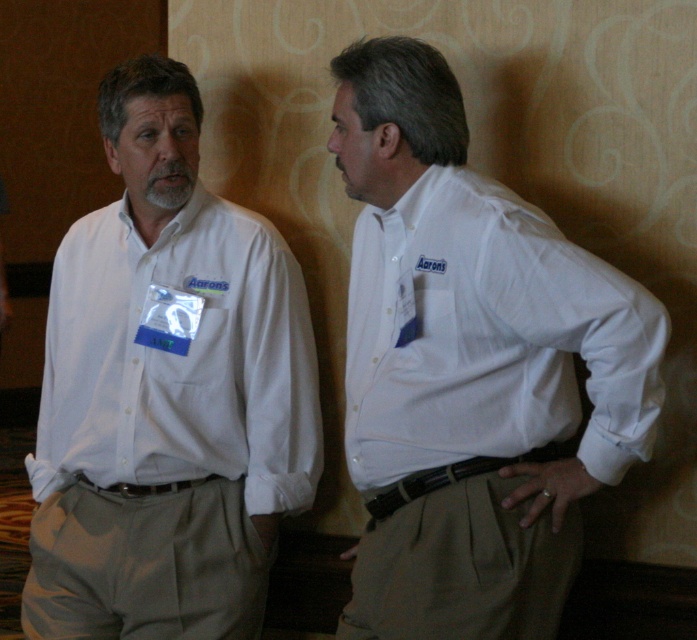
Who is taller, white cotton shirt at right or white cotton shirt at left?

With more height is white cotton shirt at left.

In the scene shown: Between white cotton shirt at right and white cotton shirt at left, which one is positioned lower?

white cotton shirt at left

Between point (454, 259) and point (56, 554), which one is positioned in front?

Positioned in front is point (454, 259).

I want to click on white cotton shirt at right, so 470,369.